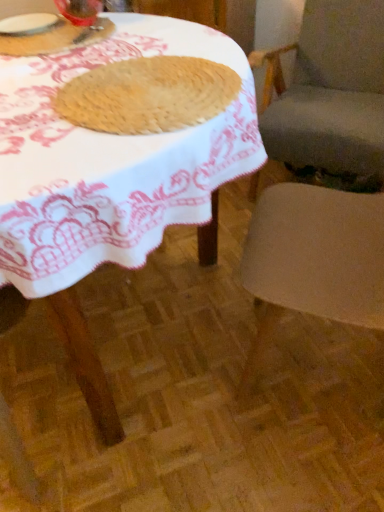
Question: Considering the positions of matte glass jar at upper left and smooth beige cushion at right, the first chair in the back-to-front sequence, in the image, is matte glass jar at upper left bigger or smaller than smooth beige cushion at right, the first chair in the back-to-front sequence,?

Choices:
 (A) big
 (B) small

Answer: (B)

Question: Is matte glass jar at upper left situated inside smooth beige cushion at right, the first chair in the back-to-front sequence, or outside?

Choices:
 (A) outside
 (B) inside

Answer: (A)

Question: Which object is the farthest from the matte glass jar at upper left?

Choices:
 (A) smooth beige cushion at right, the first chair in the back-to-front sequence
 (B) smooth beige chair at right, arranged as the 1th chair when viewed from the front
 (C) golden brown textured cookie at center
 (D) transparent glass at upper left, positioned as the second tableware in left-to-right order
 (E) wooden table at center

Answer: (A)

Question: Considering the real-world distances, which object is farthest from the white glossy plate at upper left, which is the first tableware in left-to-right order?

Choices:
 (A) matte glass jar at upper left
 (B) smooth beige chair at right, arranged as the 1th chair when viewed from the front
 (C) transparent glass at upper left, the 1th tableware from the right
 (D) wooden table at center
 (E) smooth beige cushion at right, which is the 2th chair in front-to-back order

Answer: (E)